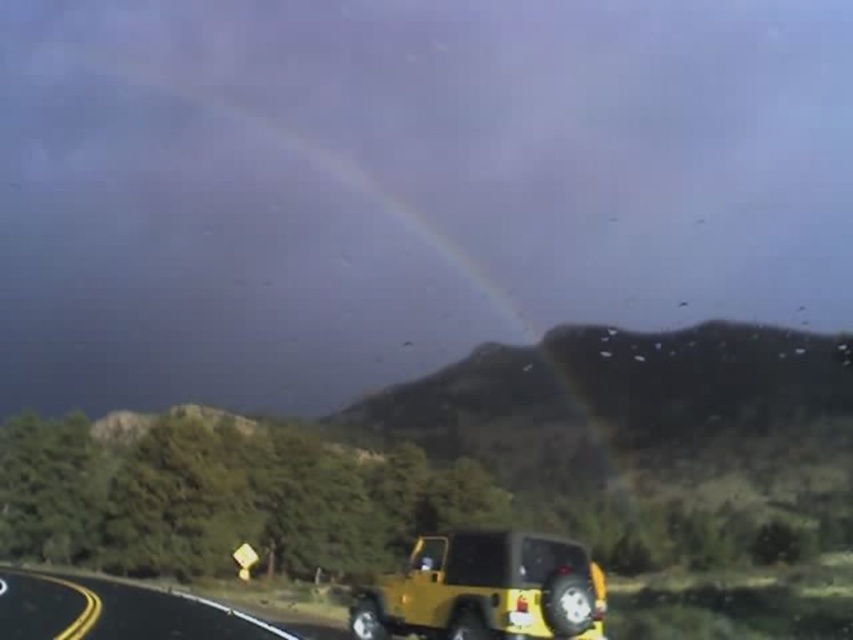
You are driving a yellow matte jeep at lower right and want to turn onto the yellow matte highway at lower left. Can you see the highway from your current position?

Yes, the yellow matte jeep at lower right can see the yellow matte highway at lower left because the jeep is in front of the highway, meaning the highway is visible behind it.

You are driving a yellow matte jeep at lower right and want to reach the yellow matte highway at lower left as quickly as possible. What is the shortest distance you can take?

The shortest distance between the yellow matte jeep at lower right and the yellow matte highway at lower left is 157.14 feet.

You are a passenger in the yellow matte jeep at lower right and want to know if you can see the yellow matte highway at lower left from your current position. Based on their positions, can you see it?

The yellow matte jeep at lower right is above the yellow matte highway at lower left, so yes, you can see the yellow matte highway at lower left from your current position in the yellow matte jeep at lower right.